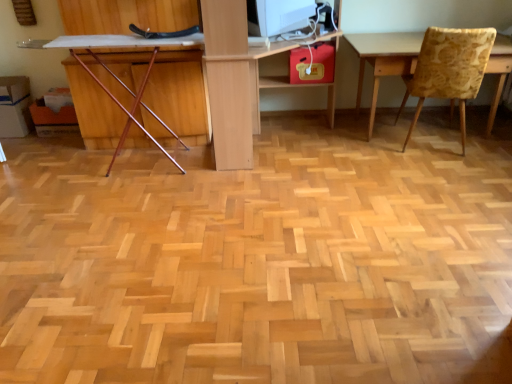
This screenshot has width=512, height=384. Identify the location of free spot in front of wooden chair at left, placed as the 2th chair when sorted from right to left. (133, 228).